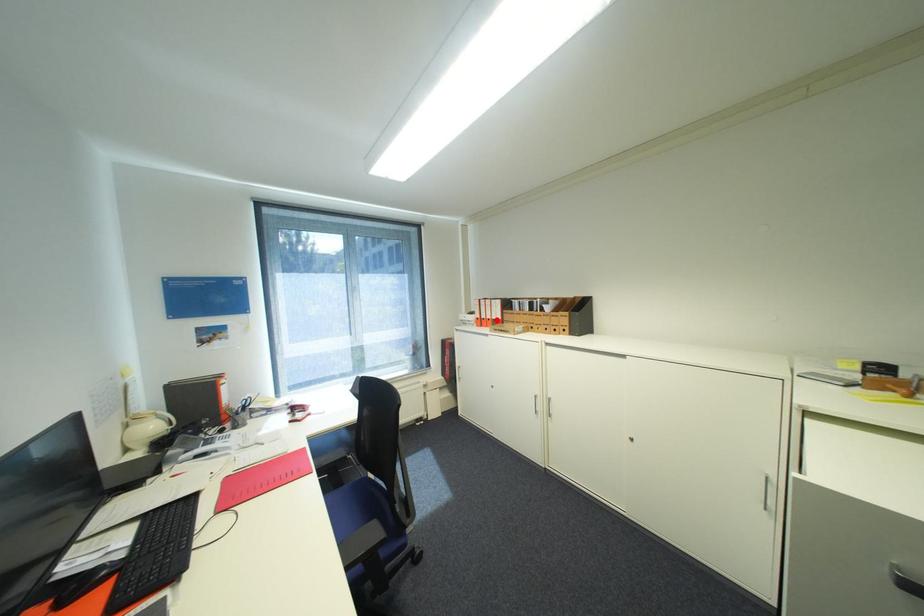
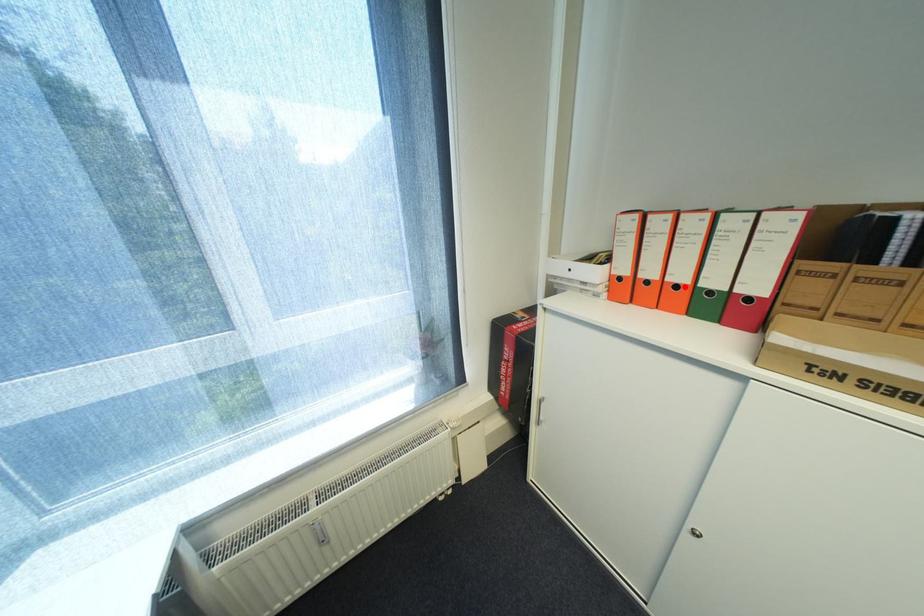
I am providing you with two images of the same scene from different viewpoints. A red point is marked on the first image and another point is marked on the second image. Do the highlighted points in image1 and image2 indicate the same real-world spot?

Yes